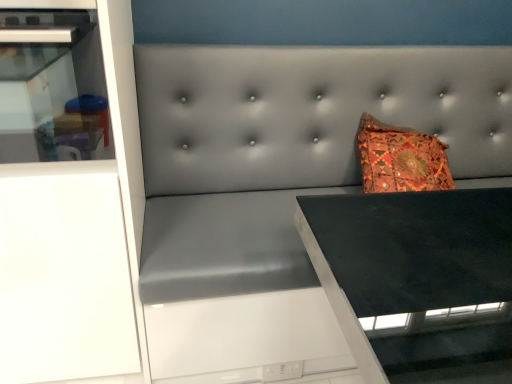
Describe the element at coordinates (66, 196) in the screenshot. I see `white matte cabinet at left` at that location.

This screenshot has width=512, height=384. What are the coordinates of `white matte cabinet at left` in the screenshot? It's located at (66, 196).

In order to face white glossy cabinet at left, should I rotate leftwards or rightwards?

You should rotate left by 27.614 degrees.

Locate an element on the screen. The height and width of the screenshot is (384, 512). white glossy cabinet at left is located at coordinates (53, 90).

Describe the element at coordinates (53, 90) in the screenshot. Image resolution: width=512 pixels, height=384 pixels. I see `white glossy cabinet at left` at that location.

Where is `white matte cabinet at left`? The width and height of the screenshot is (512, 384). white matte cabinet at left is located at coordinates (66, 196).

Considering the relative positions of white glossy cabinet at left and white matte cabinet at left in the image provided, is white glossy cabinet at left to the left or to the right of white matte cabinet at left?

In the image, white glossy cabinet at left appears on the right side of white matte cabinet at left.

Is white glossy cabinet at left in front of or behind white matte cabinet at left in the image?

white glossy cabinet at left is positioned closer to the viewer than white matte cabinet at left.

Does point (58, 16) appear closer or farther from the camera than point (57, 182)?

Point (58, 16) is positioned closer to the camera compared to point (57, 182).

From the image's perspective, is white glossy cabinet at left on white matte cabinet at left?

Yes.

From a real-world perspective, is white glossy cabinet at left under white matte cabinet at left?

No, from a real-world perspective, white glossy cabinet at left is not under white matte cabinet at left.

From the picture: Considering the sizes of objects white glossy cabinet at left and white matte cabinet at left in the image provided, who is thinner, white glossy cabinet at left or white matte cabinet at left?

Thinner between the two is white matte cabinet at left.

Who is taller, white glossy cabinet at left or white matte cabinet at left?

white matte cabinet at left.

Who is bigger, white glossy cabinet at left or white matte cabinet at left?

With larger size is white matte cabinet at left.

Is white glossy cabinet at left surrounding white matte cabinet at left?

Definitely not — white matte cabinet at left is not inside white glossy cabinet at left.

Is white glossy cabinet at left with white matte cabinet at left?

No, white glossy cabinet at left is not with white matte cabinet at left.

Is white glossy cabinet at left aimed at white matte cabinet at left?

Yes, white glossy cabinet at left is facing white matte cabinet at left.

You are a GUI agent. You are given a task and a screenshot of the screen. Output one action in this format:
    pyautogui.click(x=<x>, y=<y>)
    Task: Click on the shelf to the right of white matte cabinet at left
    Image resolution: width=512 pixels, height=384 pixels.
    Given the screenshot: What is the action you would take?
    pyautogui.click(x=53, y=90)

Which is more to the right, white matte cabinet at left or white glossy cabinet at left?

white glossy cabinet at left.

Considering the positions of objects white matte cabinet at left and white glossy cabinet at left in the image provided, who is behind, white matte cabinet at left or white glossy cabinet at left?

white matte cabinet at left is further from the camera.

Is point (40, 15) closer to camera compared to point (57, 59)?

That is True.

From the image's perspective, does white matte cabinet at left appear higher than white glossy cabinet at left?

No.

From a real-world perspective, is white matte cabinet at left located higher than white glossy cabinet at left?

Incorrect, from a real-world perspective, white matte cabinet at left is lower than white glossy cabinet at left.

Between white matte cabinet at left and white glossy cabinet at left, which one has smaller width?

Thinner between the two is white matte cabinet at left.

Considering the sizes of objects white matte cabinet at left and white glossy cabinet at left in the image provided, who is shorter, white matte cabinet at left or white glossy cabinet at left?

Standing shorter between the two is white glossy cabinet at left.

In the scene shown: Considering the relative sizes of white matte cabinet at left and white glossy cabinet at left in the image provided, is white matte cabinet at left bigger than white glossy cabinet at left?

Yes.

Would you say white matte cabinet at left is inside or outside white glossy cabinet at left?

white matte cabinet at left cannot be found inside white glossy cabinet at left.

Is white matte cabinet at left in contact with white glossy cabinet at left?

white matte cabinet at left is not next to white glossy cabinet at left, and they're not touching.

Could you tell me if white matte cabinet at left is facing white glossy cabinet at left?

Yes, white matte cabinet at left is facing white glossy cabinet at left.

This screenshot has height=384, width=512. In order to click on shelf in front of the white matte cabinet at left in this screenshot , I will do `click(53, 90)`.

In order to click on shelf located on the right of white matte cabinet at left in this screenshot , I will do `click(53, 90)`.

Locate an element on the screen. This screenshot has height=384, width=512. shelf located above the white matte cabinet at left (from a real-world perspective) is located at coordinates (53, 90).